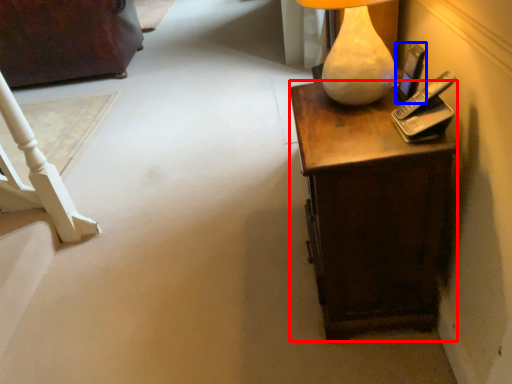
Question: Which of the following is the farthest to the observer, desk (highlighted by a red box) or mobile phone (highlighted by a blue box)?

Choices:
 (A) desk
 (B) mobile phone

Answer: (B)